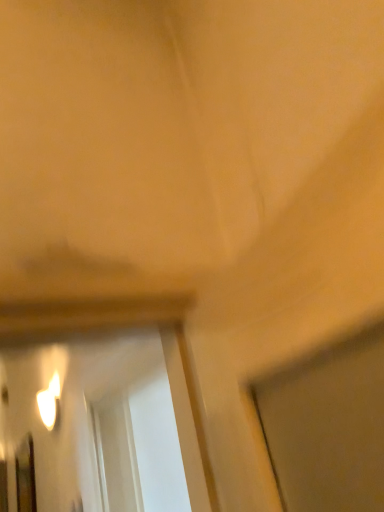
What are the coordinates of `matte white light fixture at lower left` in the screenshot? It's located at (50, 402).

In order to face matte white light fixture at lower left, should I rotate leftwards or rightwards?

Turn left by 18.866 degrees to look at matte white light fixture at lower left.

This screenshot has height=512, width=384. What do you see at coordinates (50, 402) in the screenshot?
I see `matte white light fixture at lower left` at bounding box center [50, 402].

Where is `matte white light fixture at lower left`? This screenshot has height=512, width=384. matte white light fixture at lower left is located at coordinates (50, 402).